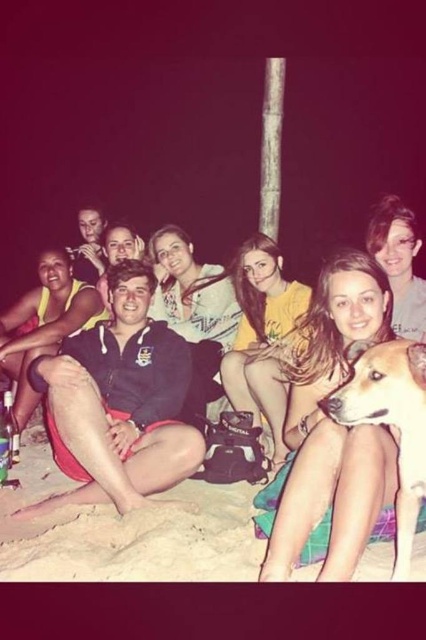
Question: Based on their relative distances, which object is farther from the golden fur dog at lower right?

Choices:
 (A) blonde hair at center
 (B) matte black jacket at center
 (C) sandy beach at lower center
 (D) black matte jacket at center

Answer: (D)

Question: Which object is the closest to the blonde hair at center?

Choices:
 (A) matte black jacket at center
 (B) golden fur dog at lower right
 (C) black matte jacket at center

Answer: (A)

Question: Does matte black jacket at center appear under black matte jacket at center?

Choices:
 (A) no
 (B) yes

Answer: (B)

Question: Which point is farther to the camera?

Choices:
 (A) (285, 476)
 (B) (351, 396)

Answer: (A)

Question: Does matte black jacket at center have a greater width compared to black matte jacket at center?

Choices:
 (A) yes
 (B) no

Answer: (B)

Question: Observing the image, what is the correct spatial positioning of matte black jacket at center in reference to golden fur dog at lower right?

Choices:
 (A) right
 (B) left

Answer: (B)